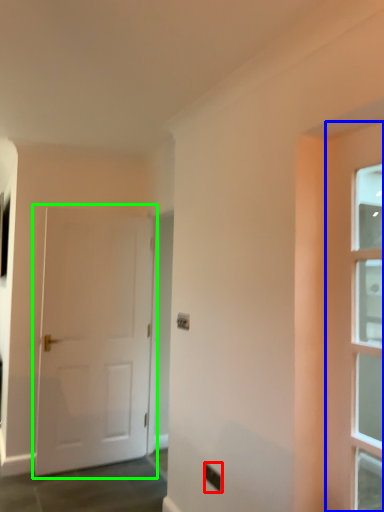
Question: Which object is positioned farthest from electric outlet (highlighted by a red box)? Select from door (highlighted by a blue box) and door (highlighted by a green box).

Choices:
 (A) door
 (B) door

Answer: (B)